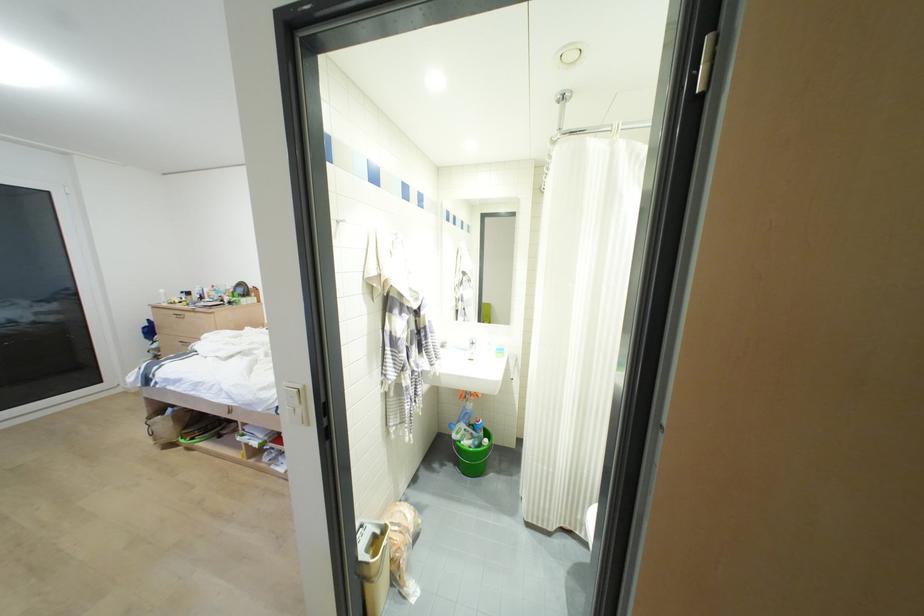
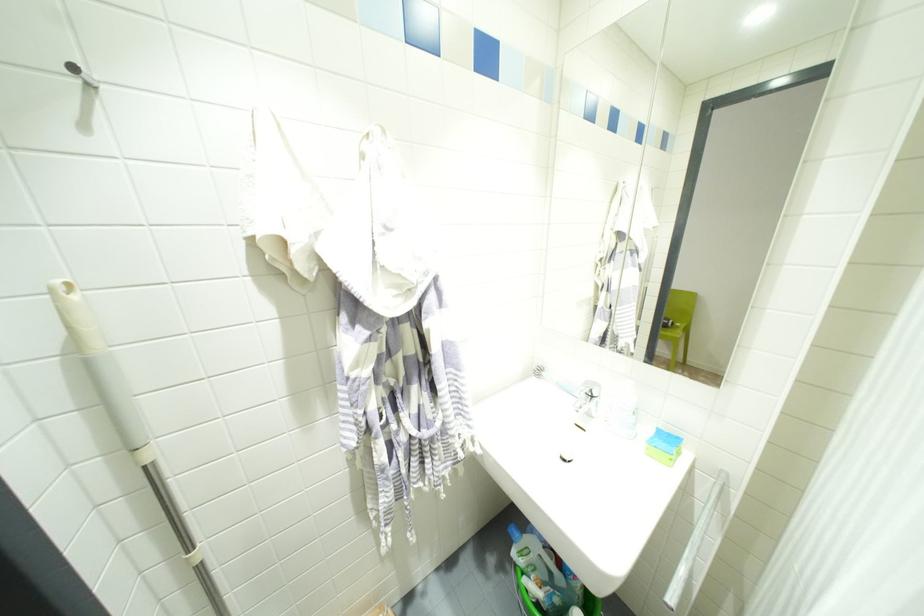
The point at (337, 222) is marked in the first image. Where is the corresponding point in the second image?

(91, 84)